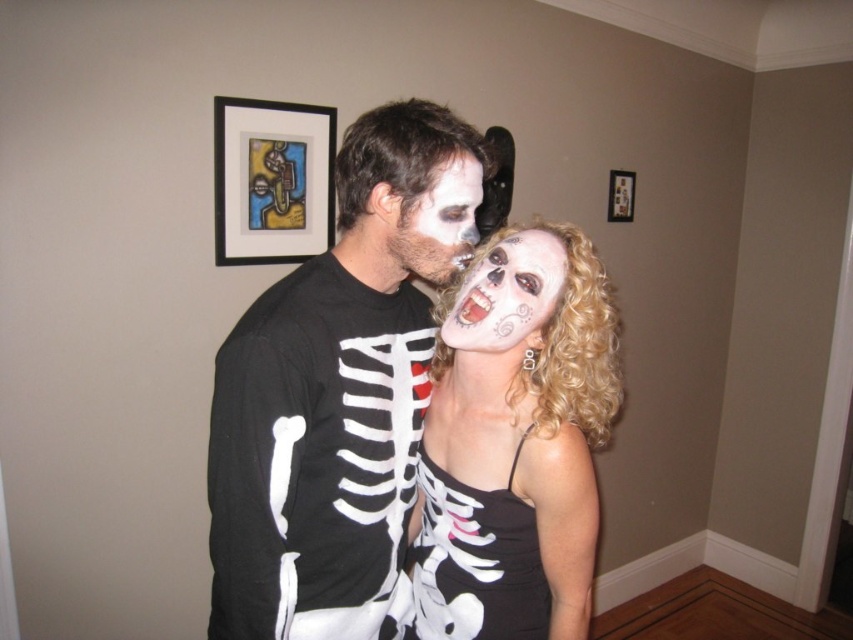
You are a photographer setting up a camera on a tripod. The camera is 1.2 meters wide. You want to capture both the black matte picture frame at upper center and the wooden picture frame at upper center in the same shot. Can the camera fit both frames in the shot if they are 1.33 meters apart?

The distance between the black matte picture frame at upper center and the wooden picture frame at upper center is 1.33 meters. Since the camera is 1.2 meters wide, it cannot capture both frames in the same shot as the distance between them exceeds the camera width.

You are a photographer trying to position a new poster exactly where the black matte picture frame at upper center is located. The frame is at coordinates point (271,180). You have a measuring tape and know the wall is 10 feet wide and 8 feet tall. Where should you place the poster in terms of left, center, or right on the wall?

The point (271,180) corresponds to the black matte picture frame at upper center, so you should place the poster at the center of the wall.

You are a photographer setting up a shoot in the room where the black satin dress at center and the white matte skull at center are displayed. You need to ensure both items fit within a rectangular backdrop that is 1.2 meters wide. Given their widths, will both items fit side by side without overlapping?

The black satin dress at center is wider than the white matte skull at center. To determine if they fit side by side, add their widths. However, since the exact measurements aren not provided, we can infer that since the dress is wider, but without knowing the exact dimensions, it is uncertain. However, according to the description, the black satin dress at center surpasses the white matte skull at center in width. Assuming the dress is significantly wider, it might exceed the 1.2 meters when combined. But,